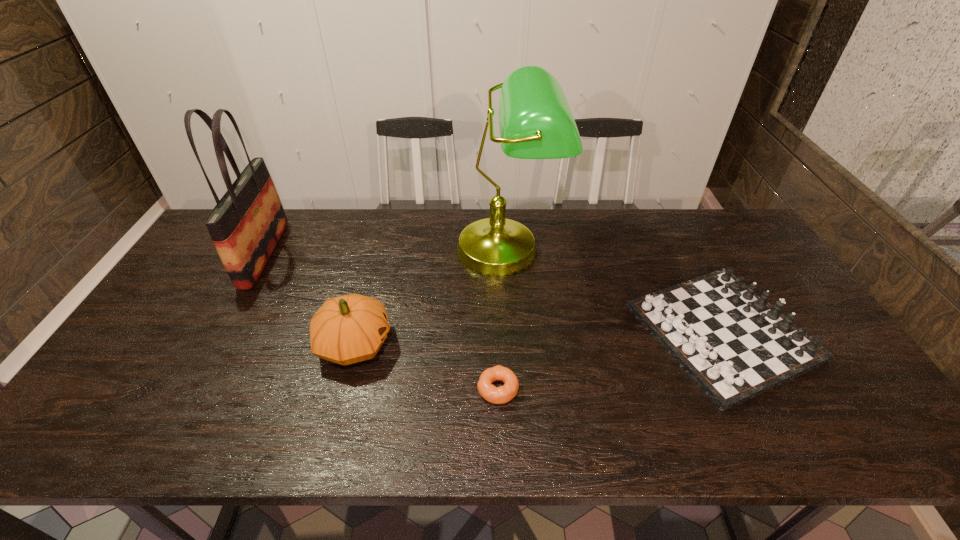
I want to click on empty space between the shopping bag and the chessboard, so click(493, 293).

Locate an element on the screen. The height and width of the screenshot is (540, 960). free area in between the doughnut and the gourd is located at coordinates (426, 366).

Identify which object is the second closest to the lamp. Please provide its 2D coordinates. Your answer should be formatted as a tuple, i.e. [(x, y)], where the tuple contains the x and y coordinates of a point satisfying the conditions above.

[(347, 329)]

Locate an element on the screen. The image size is (960, 540). object identified as the second closest to the doughnut is located at coordinates (535, 120).

Identify the location of free space that satisfies the following two spatial constraints: 1. on the front-facing side of the chessboard; 2. on the right side of the leftmost object. Image resolution: width=960 pixels, height=540 pixels. (221, 333).

Locate an element on the screen. vacant space that satisfies the following two spatial constraints: 1. on the desk next to the lamp; 2. on the front-facing side of the leftmost object is located at coordinates pos(507,254).

The image size is (960, 540). What are the coordinates of `vacant space that satisfies the following two spatial constraints: 1. on the front-facing side of the shopping bag; 2. on the back side of the chessboard` in the screenshot? It's located at (221, 333).

The image size is (960, 540). Identify the location of vacant position in the image that satisfies the following two spatial constraints: 1. on the desk next to the lamp; 2. on the side of the second object from left to right with the carved face. (514, 343).

Where is `free space that satisfies the following two spatial constraints: 1. on the front-facing side of the leftmost object; 2. on the back side of the doughnut`? The height and width of the screenshot is (540, 960). free space that satisfies the following two spatial constraints: 1. on the front-facing side of the leftmost object; 2. on the back side of the doughnut is located at coordinates (190, 389).

Find the location of a particular element. The image size is (960, 540). free location that satisfies the following two spatial constraints: 1. on the side of the third tallest object with the carved face; 2. on the left side of the shortest object is located at coordinates (343, 389).